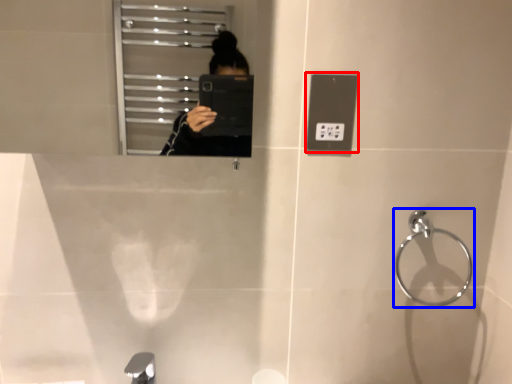
Question: Which object appears farthest to the camera in this image, light switch (highlighted by a red box) or towel bar (highlighted by a blue box)?

Choices:
 (A) light switch
 (B) towel bar

Answer: (B)